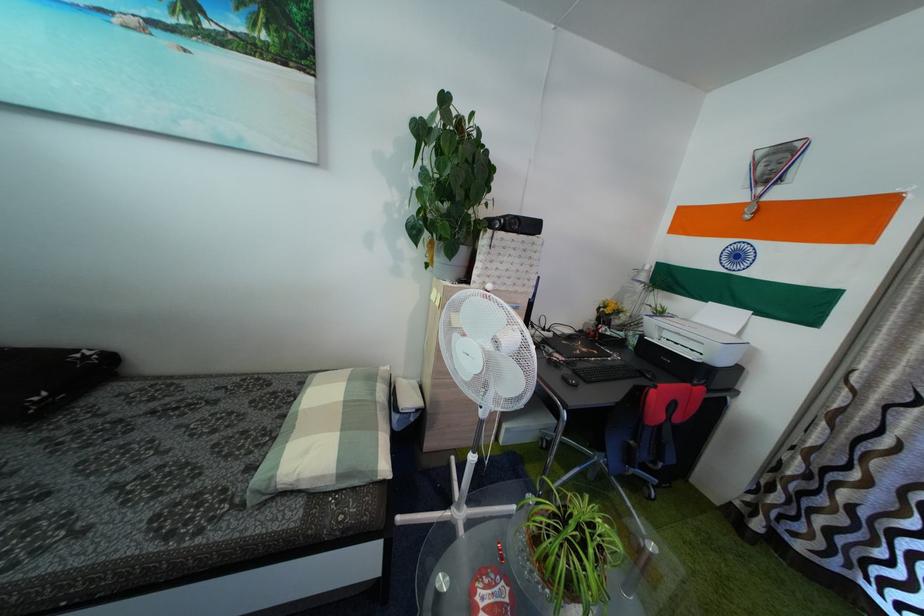
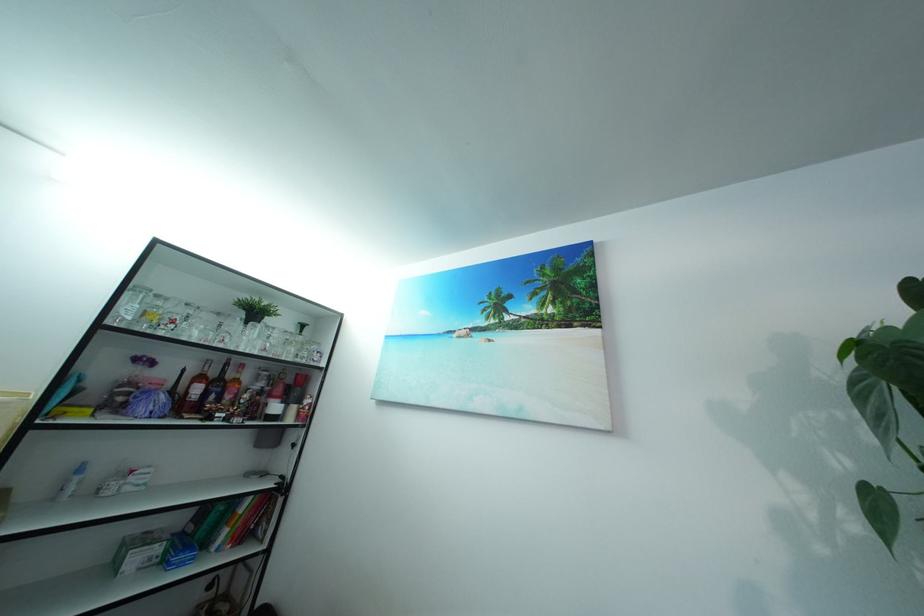
First-person continuous shooting, in which direction is the camera rotating?

The camera's rotation is toward left-up.